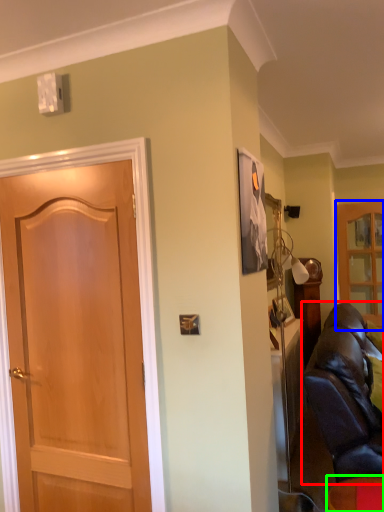
Question: Which object is the farthest from studio couch (highlighted by a red box)? Choose among these: cabinetry (highlighted by a blue box) or furniture (highlighted by a green box).

Choices:
 (A) cabinetry
 (B) furniture

Answer: (A)